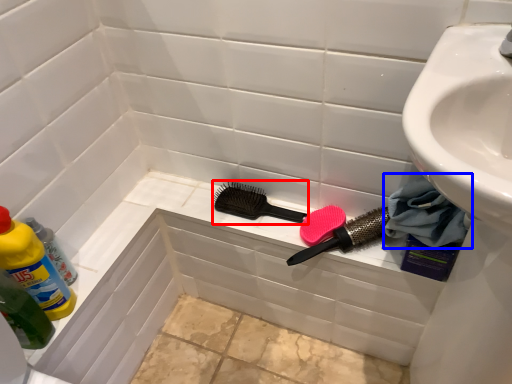
Question: Among these objects, which one is nearest to the camera, brush (highlighted by a red box) or material (highlighted by a blue box)?

Choices:
 (A) brush
 (B) material

Answer: (B)